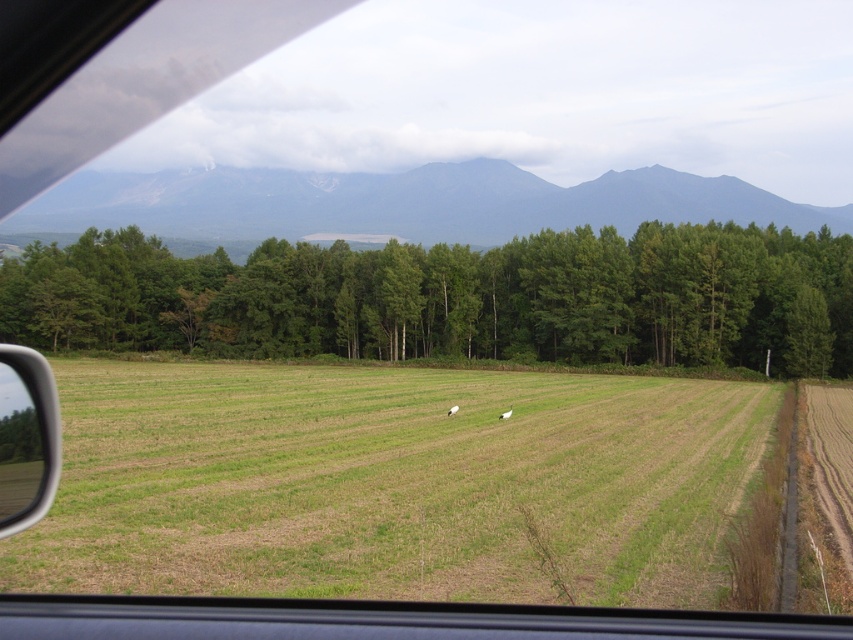
You are sitting in the driver seat of the car shown in the scene. You see two points marked on the window. One is at point (492, 554) and the other is at point (666, 212). Which point is closer to you?

Point (492, 554) is closer to the camera than point (666, 212), so the point at (492, 554) is closer to you.